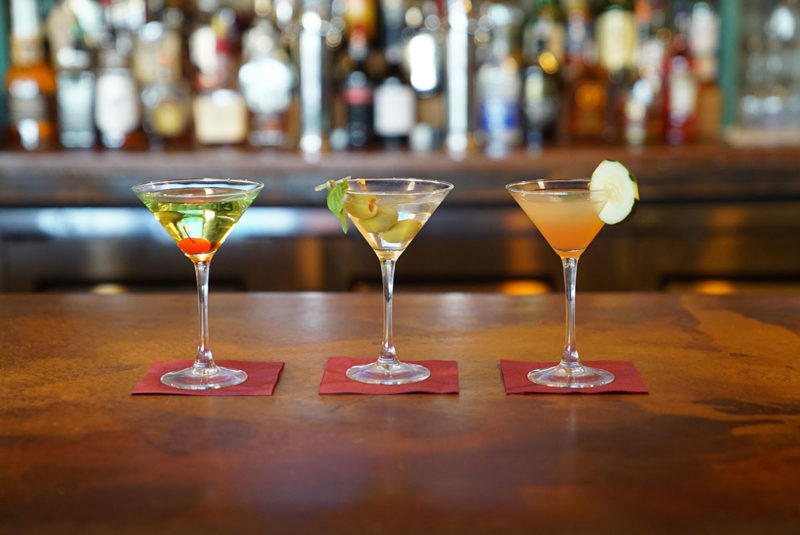
Identify the location of bottles. The image size is (800, 535). (194, 73), (586, 61).